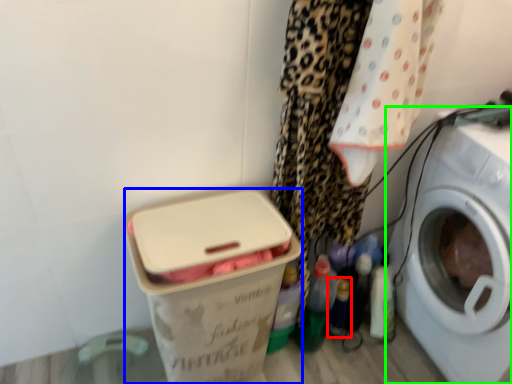
Question: Which object is the closest to the bottle (highlighted by a red box)? Choose among these: box (highlighted by a blue box) or washing machine (highlighted by a green box).

Choices:
 (A) box
 (B) washing machine

Answer: (B)